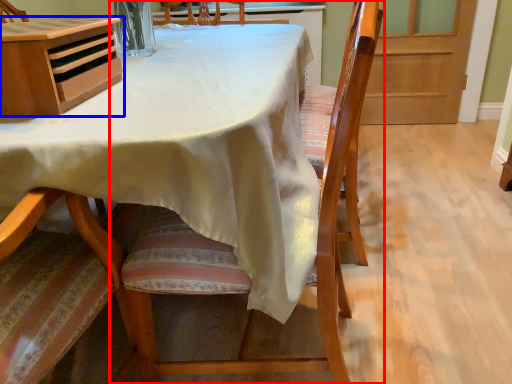
Question: Which of the following is the farthest to the observer, chair (highlighted by a red box) or cabinetry (highlighted by a blue box)?

Choices:
 (A) chair
 (B) cabinetry

Answer: (B)